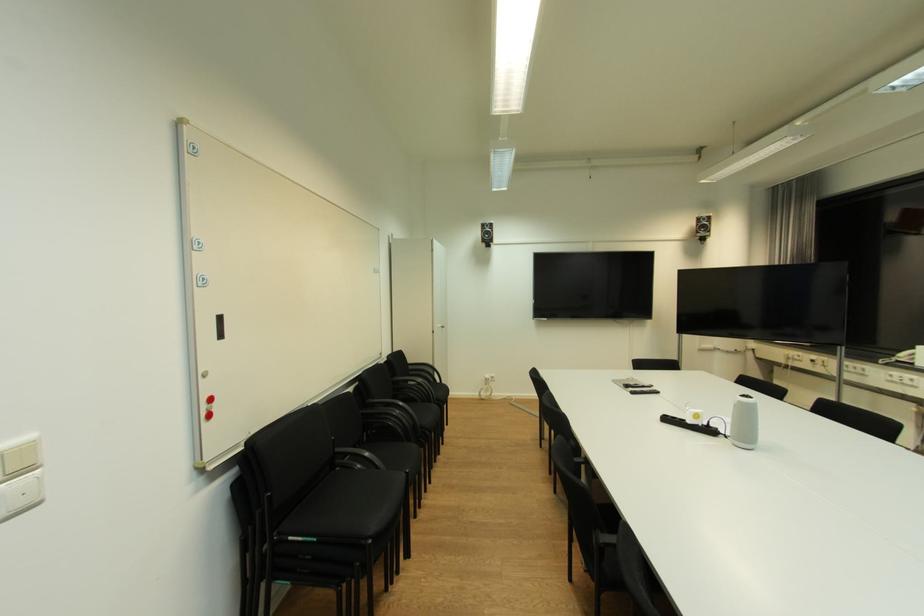
Locate an element on the screen. white light switch is located at coordinates (20, 476).